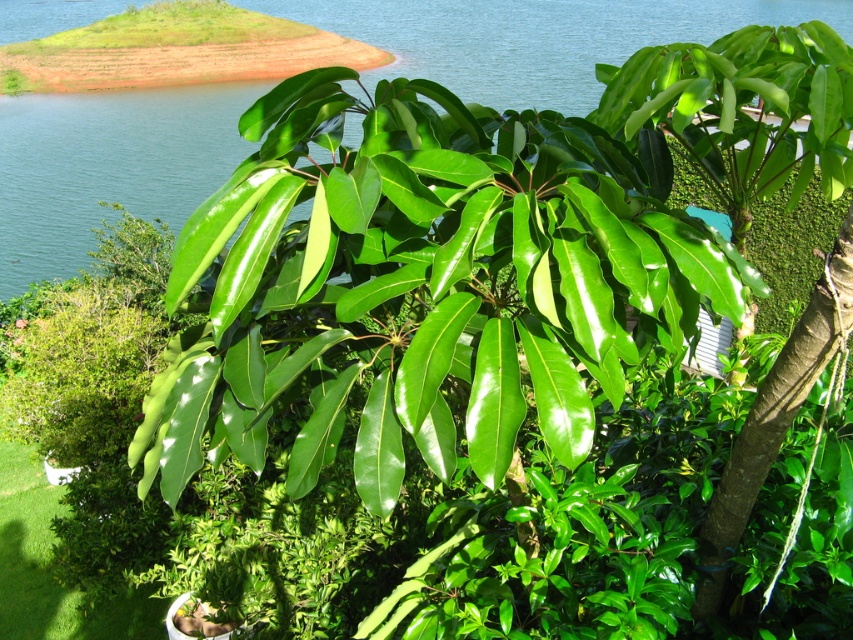
Question: Which point is closer to the camera?

Choices:
 (A) (202, 90)
 (B) (770, 184)

Answer: (B)

Question: Which object is closer to the camera taking this photo?

Choices:
 (A) green glossy leaves at center
 (B) green water at upper center

Answer: (A)

Question: Is green water at upper center to the right of green glossy leaves at center from the viewer's perspective?

Choices:
 (A) no
 (B) yes

Answer: (A)

Question: Can you confirm if green water at upper center is positioned to the left of green glossy leaves at center?

Choices:
 (A) yes
 (B) no

Answer: (A)

Question: Does green water at upper center appear on the right side of green glossy leaves at center?

Choices:
 (A) yes
 (B) no

Answer: (B)